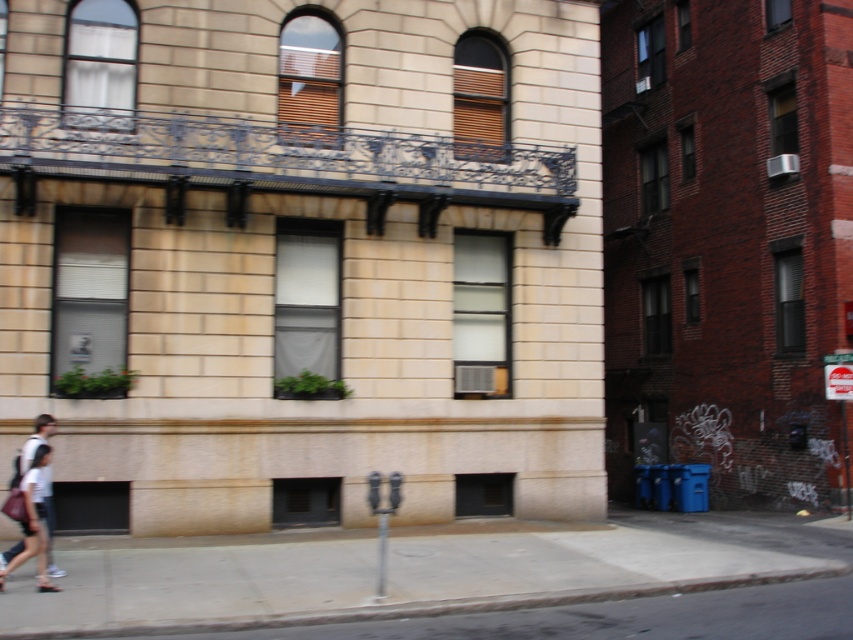
Question: Is gray concrete sidewalk at lower center to the right of white cotton shirt at lower left from the viewer's perspective?

Choices:
 (A) no
 (B) yes

Answer: (B)

Question: Which point is closer to the camera taking this photo?

Choices:
 (A) (129, 570)
 (B) (20, 470)

Answer: (B)

Question: Which of the following is the farthest from the observer?

Choices:
 (A) (759, 516)
 (B) (47, 522)

Answer: (A)

Question: Does gray concrete sidewalk at lower center appear on the right side of white cotton shirt at lower left?

Choices:
 (A) no
 (B) yes

Answer: (B)

Question: Where is gray concrete sidewalk at lower center located in relation to white cotton shirt at lower left in the image?

Choices:
 (A) above
 (B) below

Answer: (B)

Question: Which of the following is the closest to the observer?

Choices:
 (A) (4, 561)
 (B) (782, 529)

Answer: (A)